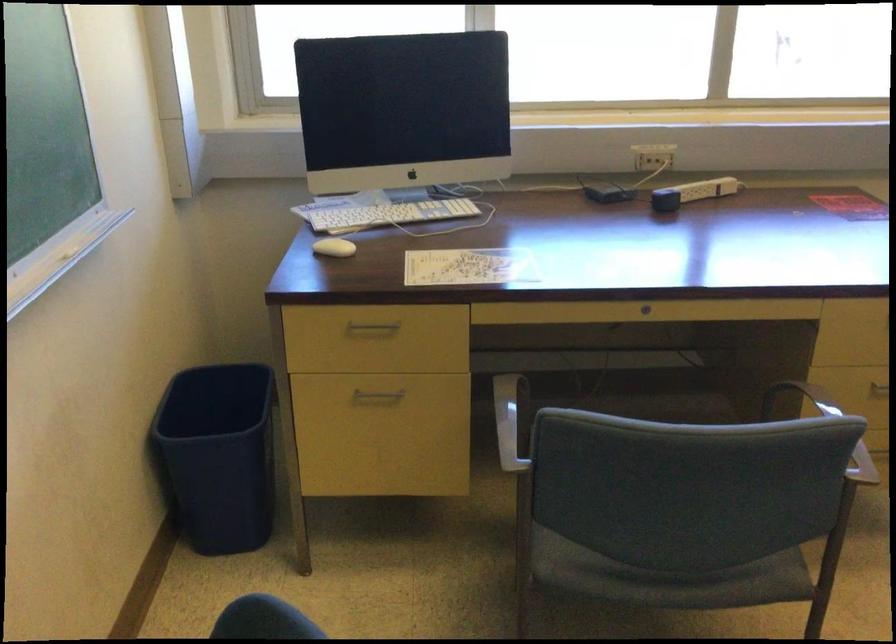
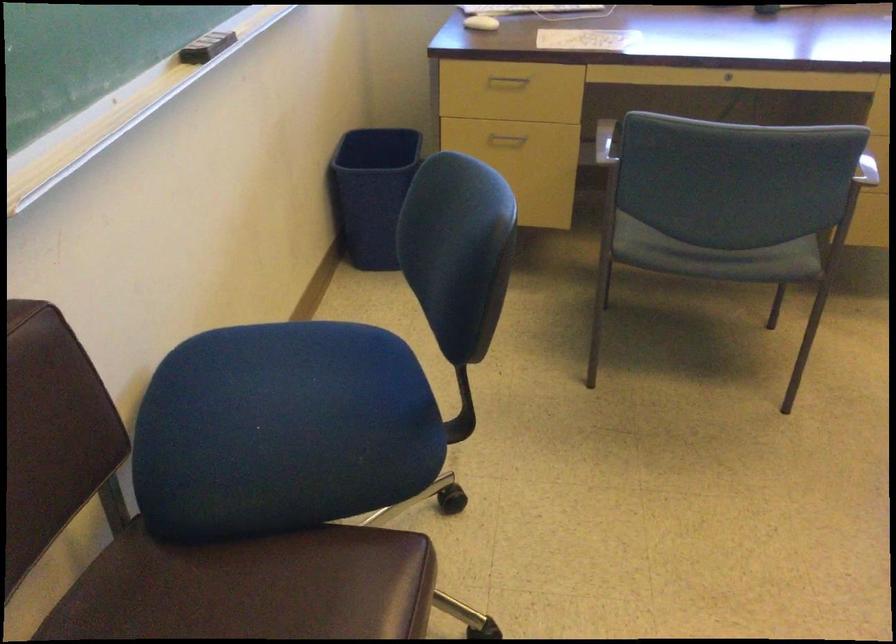
Question: In a continuous first-person perspective shot, in which direction is the camera moving?

Choices:
 (A) Left
 (B) Right
 (C) Forward
 (D) Backward

Answer: (D)